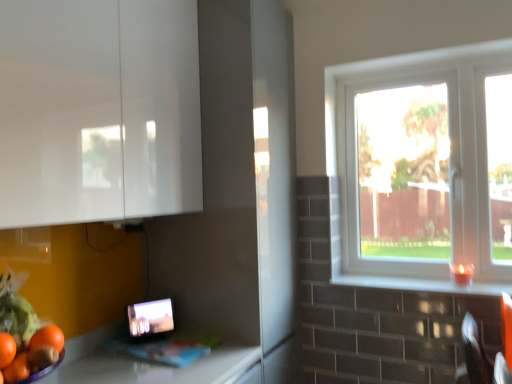
Locate an element on the screen. The image size is (512, 384). matte black tablet at lower left is located at coordinates (150, 319).

I want to click on white glossy window sill at right, so click(x=420, y=284).

Where is `white plastic window at right`? white plastic window at right is located at coordinates [x=421, y=166].

The image size is (512, 384). Find the location of `matte black tablet at lower left`. matte black tablet at lower left is located at coordinates (150, 319).

Where is `window sill on the right side of matte black tablet at lower left`? This screenshot has height=384, width=512. window sill on the right side of matte black tablet at lower left is located at coordinates (420, 284).

Between white glossy window sill at right and matte black tablet at lower left, which one has smaller size?

white glossy window sill at right is smaller.

Between white glossy window sill at right and matte black tablet at lower left, which one has less height?

With less height is white glossy window sill at right.

Considering the sizes of white glossy window sill at right and matte black tablet at lower left in the image, is white glossy window sill at right wider or thinner than matte black tablet at lower left?

Considering their sizes, white glossy window sill at right looks broader than matte black tablet at lower left.

In terms of size, does white plastic window at right appear bigger or smaller than white glossy cabinet at upper left?

Considering their sizes, white plastic window at right takes up less space than white glossy cabinet at upper left.

Considering the positions of points (426, 255) and (188, 4), is point (426, 255) closer to camera compared to point (188, 4)?

No, (426, 255) is further to viewer.

From the image's perspective, is white plastic window at right located beneath white glossy cabinet at upper left?

Indeed, from the image's perspective, white plastic window at right is shown beneath white glossy cabinet at upper left.

From the picture: Is white glossy cabinet at upper left a part of white plastic window at right?

No, white glossy cabinet at upper left is not inside white plastic window at right.

Based on the photo, can we say white glossy window sill at right lies outside white plastic window at right?

That's correct, white glossy window sill at right is outside of white plastic window at right.

Locate an element on the screen. The image size is (512, 384). window sill that is below the white plastic window at right (from the image's perspective) is located at coordinates (420, 284).

Is white glossy window sill at right positioned behind white plastic window at right?

No, white glossy window sill at right is closer to the viewer.

Which of these two, white glossy window sill at right or white plastic window at right, stands taller?

white plastic window at right is taller.

Is white plastic window at right at the left side of white glossy window sill at right?

No.

Measure the distance from white plastic window at right to white glossy window sill at right.

44.60 centimeters.

Which is correct: white plastic window at right is inside white glossy window sill at right, or outside of it?

The correct answer is: outside.

Does white glossy cabinet at upper left have a lesser width compared to matte black tablet at lower left?

No, white glossy cabinet at upper left is not thinner than matte black tablet at lower left.

Is white glossy cabinet at upper left to the left of matte black tablet at lower left from the viewer's perspective?

Correct, you'll find white glossy cabinet at upper left to the left of matte black tablet at lower left.

From the image's perspective, between white glossy cabinet at upper left and matte black tablet at lower left, which one is located above?

white glossy cabinet at upper left appears higher in the image.

Is white glossy window sill at right positioned with its back to white glossy cabinet at upper left?

No.

From a real-world perspective, is white glossy window sill at right below white glossy cabinet at upper left?

Yes, from a real-world perspective, white glossy window sill at right is beneath white glossy cabinet at upper left.

Can you confirm if white glossy window sill at right is positioned to the right of white glossy cabinet at upper left?

Yes.

How different are the orientations of white glossy window sill at right and white glossy cabinet at upper left in degrees?

There is a 90.4-degree angle between the facing directions of white glossy window sill at right and white glossy cabinet at upper left.

Considering their positions, is white plastic window at right located in front of or behind matte black tablet at lower left?

white plastic window at right is positioned farther from the viewer than matte black tablet at lower left.

From a real-world perspective, is white plastic window at right above or below matte black tablet at lower left?

In terms of real-world spatial position, white plastic window at right is above matte black tablet at lower left.

Is point (457, 128) positioned in front of point (129, 309)?

No, it is not.

From the image's perspective, is white plastic window at right above matte black tablet at lower left?

Yes, from the image's perspective, white plastic window at right is above matte black tablet at lower left.

Find the location of a particular element. window sill located above the matte black tablet at lower left (from a real-world perspective) is located at coordinates (420, 284).

Image resolution: width=512 pixels, height=384 pixels. I want to click on cabinetry on the left of white plastic window at right, so (98, 110).

Which object lies further to the anchor point white plastic window at right, white glossy window sill at right or matte black tablet at lower left?

matte black tablet at lower left lies further to white plastic window at right than the other object.

Estimate the real-world distances between objects in this image. Which object is closer to white plastic window at right, matte black tablet at lower left or white glossy cabinet at upper left?

white glossy cabinet at upper left is positioned closer to the anchor white plastic window at right.

Looking at the image, which one is located further to white glossy cabinet at upper left, white glossy window sill at right or white plastic window at right?

white glossy window sill at right.

Estimate the real-world distances between objects in this image. Which object is closer to white glossy window sill at right, white glossy cabinet at upper left or white plastic window at right?

white plastic window at right is positioned closer to the anchor white glossy window sill at right.

Estimate the real-world distances between objects in this image. Which object is closer to matte black tablet at lower left, white glossy window sill at right or white glossy cabinet at upper left?

The object closer to matte black tablet at lower left is white glossy cabinet at upper left.

Considering their positions, is white glossy window sill at right positioned closer to white plastic window at right than white glossy cabinet at upper left?

Based on the image, white glossy window sill at right appears to be nearer to white plastic window at right.

Based on their spatial positions, is white glossy cabinet at upper left or matte black tablet at lower left further from white plastic window at right?

matte black tablet at lower left is positioned further to the anchor white plastic window at right.

When comparing their distances from white glossy window sill at right, does white plastic window at right or white glossy cabinet at upper left seem closer?

Based on the image, white plastic window at right appears to be nearer to white glossy window sill at right.

Locate an element on the screen. Image resolution: width=512 pixels, height=384 pixels. window sill between white glossy cabinet at upper left and white plastic window at right from left to right is located at coordinates (x=420, y=284).

This screenshot has height=384, width=512. In order to click on window sill located between matte black tablet at lower left and white plastic window at right in the left-right direction in this screenshot , I will do `click(420, 284)`.

In order to click on tablet computer between white glossy cabinet at upper left and white glossy window sill at right in the horizontal direction in this screenshot , I will do `click(150, 319)`.

Locate an element on the screen. tablet computer between white glossy cabinet at upper left and white plastic window at right from left to right is located at coordinates (150, 319).